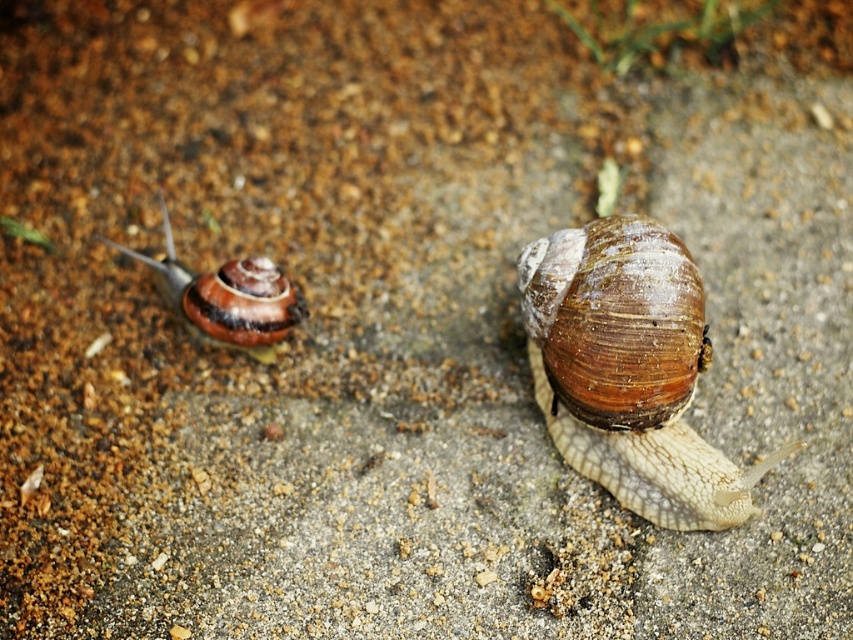
Question: Is brown shiny shell at center positioned at the back of shiny brown shell at left?

Choices:
 (A) yes
 (B) no

Answer: (B)

Question: Which of the following is the farthest from the observer?

Choices:
 (A) brown shiny shell at center
 (B) shiny brown shell at left

Answer: (B)

Question: Among these points, which one is nearest to the camera?

Choices:
 (A) (280, 337)
 (B) (679, 332)

Answer: (B)

Question: Does brown shiny shell at center appear on the right side of shiny brown shell at left?

Choices:
 (A) yes
 (B) no

Answer: (A)

Question: Does brown shiny shell at center have a larger size compared to shiny brown shell at left?

Choices:
 (A) no
 (B) yes

Answer: (B)